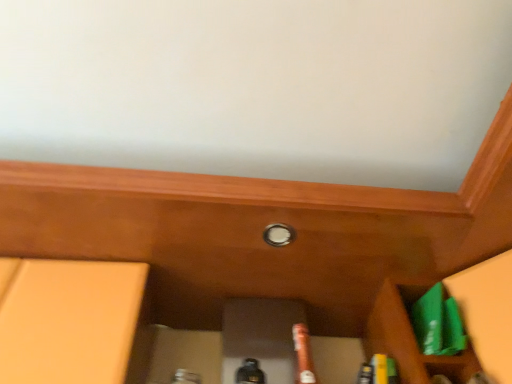
Question: Considering the relative sizes of brown matte beer bottle at center and white glossy knob at center in the image provided, is brown matte beer bottle at center thinner than white glossy knob at center?

Choices:
 (A) yes
 (B) no

Answer: (B)

Question: From the image's perspective, would you say brown matte beer bottle at center is shown under white glossy knob at center?

Choices:
 (A) yes
 (B) no

Answer: (A)

Question: Does brown matte beer bottle at center appear on the left side of white glossy knob at center?

Choices:
 (A) yes
 (B) no

Answer: (B)

Question: Does brown matte beer bottle at center come in front of white glossy knob at center?

Choices:
 (A) yes
 (B) no

Answer: (A)

Question: From the image's perspective, would you say brown matte beer bottle at center is positioned over white glossy knob at center?

Choices:
 (A) no
 (B) yes

Answer: (A)

Question: Can you confirm if brown matte beer bottle at center is taller than white glossy knob at center?

Choices:
 (A) yes
 (B) no

Answer: (A)

Question: Considering the relative sizes of white glossy knob at center and green plastic bag at lower right in the image provided, is white glossy knob at center smaller than green plastic bag at lower right?

Choices:
 (A) no
 (B) yes

Answer: (B)

Question: Does white glossy knob at center turn towards green plastic bag at lower right?

Choices:
 (A) no
 (B) yes

Answer: (A)

Question: From the image's perspective, is white glossy knob at center located beneath green plastic bag at lower right?

Choices:
 (A) no
 (B) yes

Answer: (A)

Question: Would you say white glossy knob at center is outside green plastic bag at lower right?

Choices:
 (A) yes
 (B) no

Answer: (A)

Question: Is white glossy knob at center behind green plastic bag at lower right?

Choices:
 (A) yes
 (B) no

Answer: (A)

Question: From a real-world perspective, is white glossy knob at center over green plastic bag at lower right?

Choices:
 (A) yes
 (B) no

Answer: (A)

Question: Is brown matte beer bottle at center at the left side of green plastic bag at lower right?

Choices:
 (A) no
 (B) yes

Answer: (B)